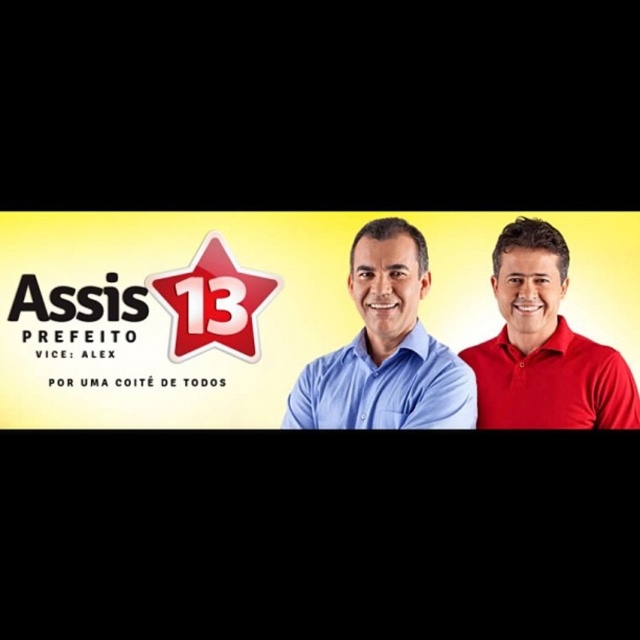
Question: Which point is closer to the camera?

Choices:
 (A) (396, 332)
 (B) (205, 296)
 (C) (520, 387)

Answer: (A)

Question: Which of the following is the closest to the observer?

Choices:
 (A) matte red star at center
 (B) blue shirt at center
 (C) red smooth polo shirt at right

Answer: (B)

Question: In this image, where is red smooth polo shirt at right located relative to matte red star at center?

Choices:
 (A) right
 (B) left

Answer: (A)

Question: Can you confirm if red smooth polo shirt at right is bigger than matte red star at center?

Choices:
 (A) yes
 (B) no

Answer: (A)

Question: Which point is farther to the camera?

Choices:
 (A) blue shirt at center
 (B) matte red star at center
 (C) red smooth polo shirt at right

Answer: (B)

Question: Can you confirm if red smooth polo shirt at right is positioned to the left of matte red star at center?

Choices:
 (A) yes
 (B) no

Answer: (B)